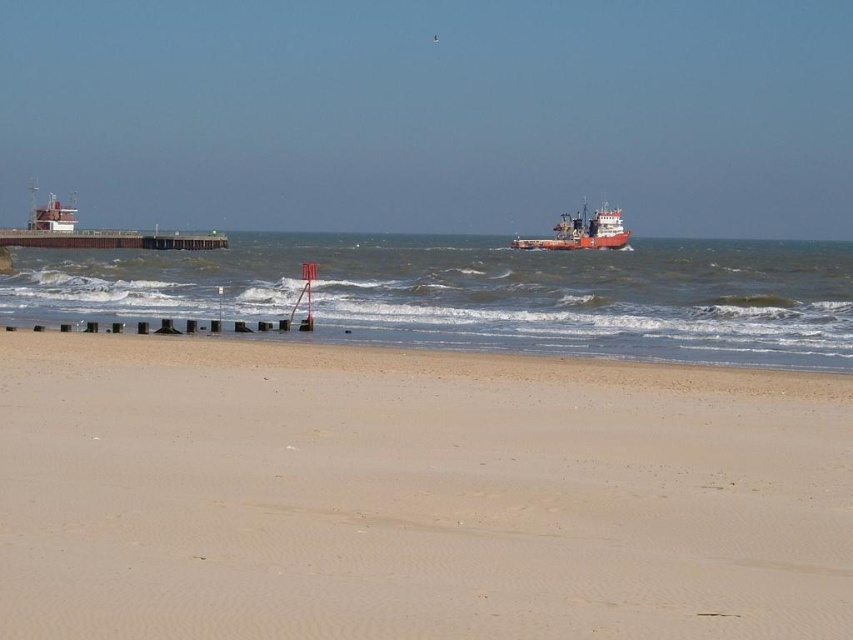
Is brown sandy water at center to the left of red matte ship at center from the viewer's perspective?

Correct, you'll find brown sandy water at center to the left of red matte ship at center.

Between brown sandy water at center and red matte ship at center, which one is positioned higher?

red matte ship at center is above.

Measure the distance between point (721, 296) and camera.

They are 186.58 feet apart.

You are a GUI agent. You are given a task and a screenshot of the screen. Output one action in this format:
    pyautogui.click(x=<x>, y=<y>)
    Task: Click on the brown sandy water at center
    The height and width of the screenshot is (640, 853).
    Given the screenshot: What is the action you would take?
    pyautogui.click(x=479, y=292)

Can you confirm if beige sandy beach at lower center is positioned below red matte ship at center?

Correct, beige sandy beach at lower center is located below red matte ship at center.

Can you confirm if beige sandy beach at lower center is positioned to the right of red matte ship at center?

No, beige sandy beach at lower center is not to the right of red matte ship at center.

At what (x,y) coordinates should I click in order to perform the action: click on beige sandy beach at lower center. Please return your answer as a coordinate pair (x, y). Looking at the image, I should click on (413, 496).

Who is positioned more to the left, wooden dock at left or red matte ship at center?

wooden dock at left

How far apart are wooden dock at left and red matte ship at center?

wooden dock at left and red matte ship at center are 39.78 meters apart from each other.

Is point (99, 237) positioned in front of point (622, 221)?

Yes, point (99, 237) is in front of point (622, 221).

Identify the location of wooden dock at left. The height and width of the screenshot is (640, 853). (109, 240).